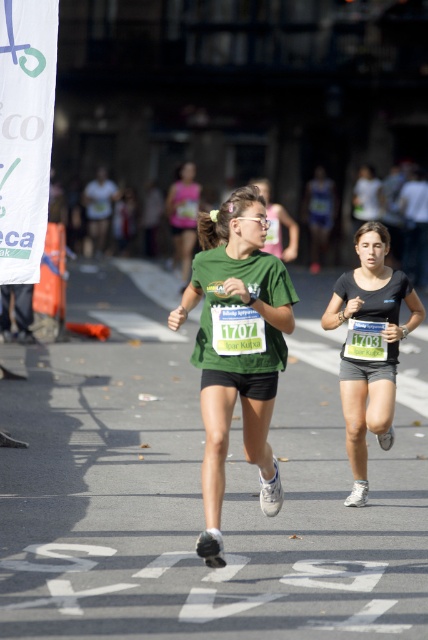
Can you confirm if black matte shorts at center is positioned to the left of matte green t-shirt at center?

In fact, black matte shorts at center is to the right of matte green t-shirt at center.

Which is in front, point (371, 426) or point (196, 209)?

Point (371, 426) is more forward.

What are the coordinates of `black matte shorts at center` in the screenshot? It's located at (369, 346).

Between green matte shirt at center and matte green t-shirt at center, which one appears on the right side from the viewer's perspective?

From the viewer's perspective, green matte shirt at center appears more on the right side.

Is green matte shirt at center bigger than matte green t-shirt at center?

Indeed, green matte shirt at center has a larger size compared to matte green t-shirt at center.

Who is more distant from viewer, (276, 513) or (187, 209)?

Point (187, 209)

The width and height of the screenshot is (428, 640). Find the location of `green matte shirt at center`. green matte shirt at center is located at coordinates (237, 348).

Measure the distance between green matte shirt at center and camera.

6.07 meters

Between green matte shirt at center and black matte shorts at center, which one appears on the right side from the viewer's perspective?

Positioned to the right is black matte shorts at center.

Between point (202, 547) and point (353, 358), which one is positioned in front?

Positioned in front is point (202, 547).

Locate an element on the screen. This screenshot has height=640, width=428. green matte shirt at center is located at coordinates (237, 348).